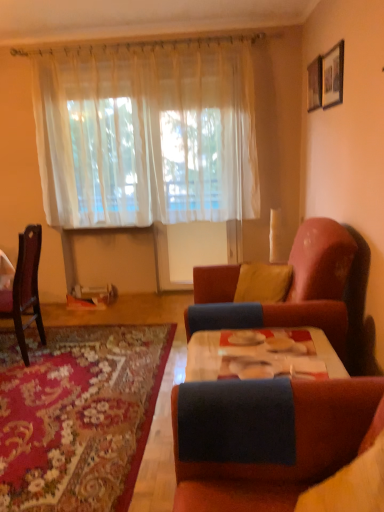
Question: Is sheer white curtain at upper center outside of velvet pink couch at right?

Choices:
 (A) no
 (B) yes

Answer: (B)

Question: Is sheer white curtain at upper center not near velvet pink couch at right?

Choices:
 (A) yes
 (B) no

Answer: (A)

Question: From a real-world perspective, is sheer white curtain at upper center positioned over velvet pink couch at right based on gravity?

Choices:
 (A) yes
 (B) no

Answer: (A)

Question: From the image's perspective, is sheer white curtain at upper center beneath velvet pink couch at right?

Choices:
 (A) no
 (B) yes

Answer: (A)

Question: Is velvet pink couch at right completely or partially inside sheer white curtain at upper center?

Choices:
 (A) yes
 (B) no

Answer: (B)

Question: Is sheer white curtain at upper center looking in the opposite direction of velvet pink couch at right?

Choices:
 (A) yes
 (B) no

Answer: (B)

Question: From a real-world perspective, does translucent fabric curtain at center stand above wooden picture frame at upper right, placed as the 1th picture frame when sorted from back to front?

Choices:
 (A) no
 (B) yes

Answer: (A)

Question: Is translucent fabric curtain at center next to wooden picture frame at upper right, placed as the 1th picture frame when sorted from back to front, and touching it?

Choices:
 (A) yes
 (B) no

Answer: (B)

Question: Does translucent fabric curtain at center have a greater height compared to wooden picture frame at upper right, which appears as the second picture frame when viewed from the front?

Choices:
 (A) no
 (B) yes

Answer: (B)

Question: Considering the relative positions of translucent fabric curtain at center and wooden picture frame at upper right, which appears as the second picture frame when viewed from the front, in the image provided, is translucent fabric curtain at center in front of wooden picture frame at upper right, which appears as the second picture frame when viewed from the front,?

Choices:
 (A) no
 (B) yes

Answer: (A)

Question: Is translucent fabric curtain at center wider than wooden picture frame at upper right, placed as the 1th picture frame when sorted from back to front?

Choices:
 (A) yes
 (B) no

Answer: (A)

Question: From the image's perspective, is translucent fabric curtain at center on top of wooden picture frame at upper right, placed as the 1th picture frame when sorted from back to front?

Choices:
 (A) no
 (B) yes

Answer: (A)

Question: Is sheer white curtain at upper center to the left of yellow fabric pillow at center from the viewer's perspective?

Choices:
 (A) no
 (B) yes

Answer: (B)